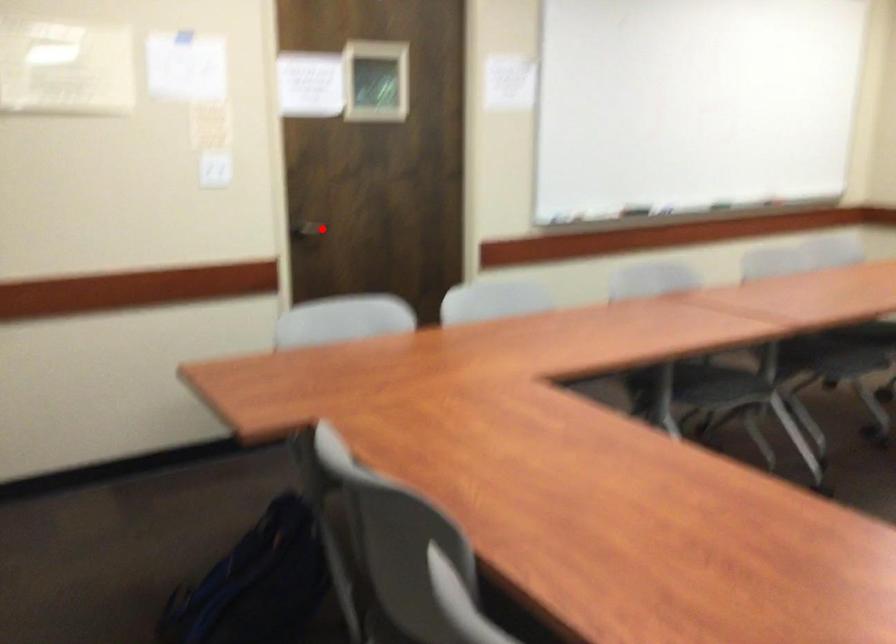
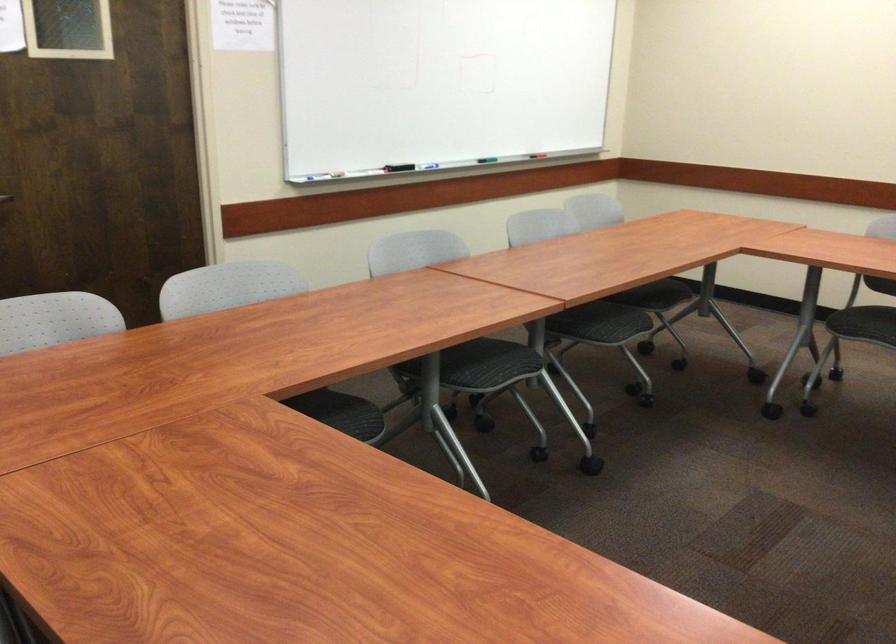
Locate, in the second image, the point that corresponds to the highlighted location in the first image.

(5, 198)